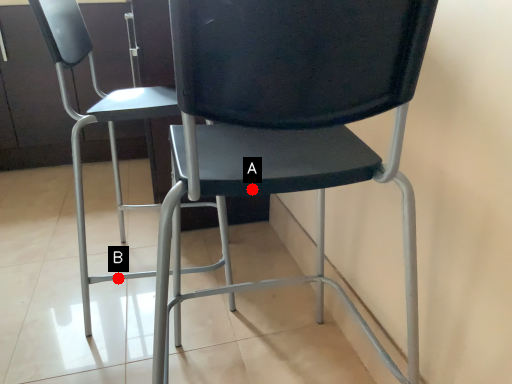
Question: Two points are circled on the image, labeled by A and B beside each circle. Which point is closer to the camera?

Choices:
 (A) A is closer
 (B) B is closer

Answer: (A)